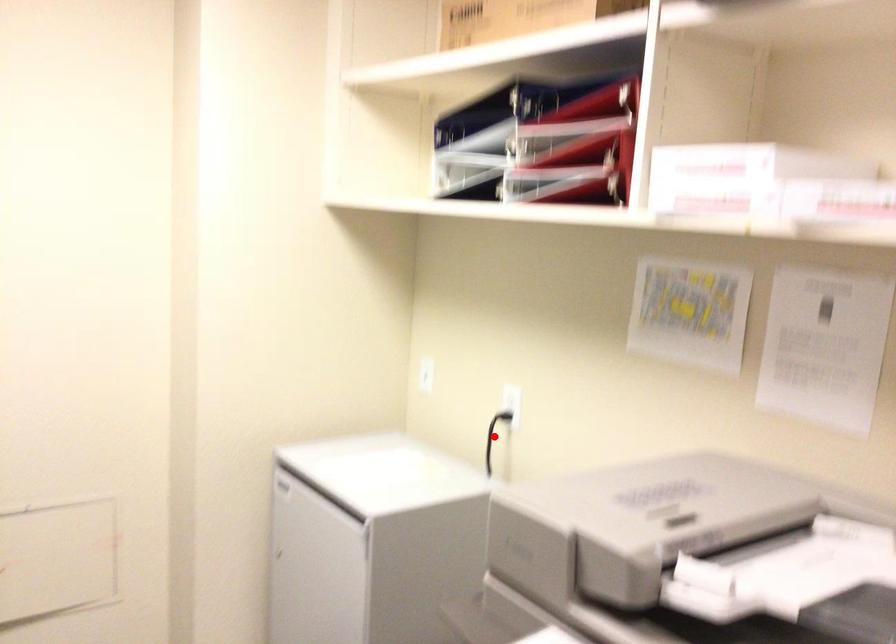
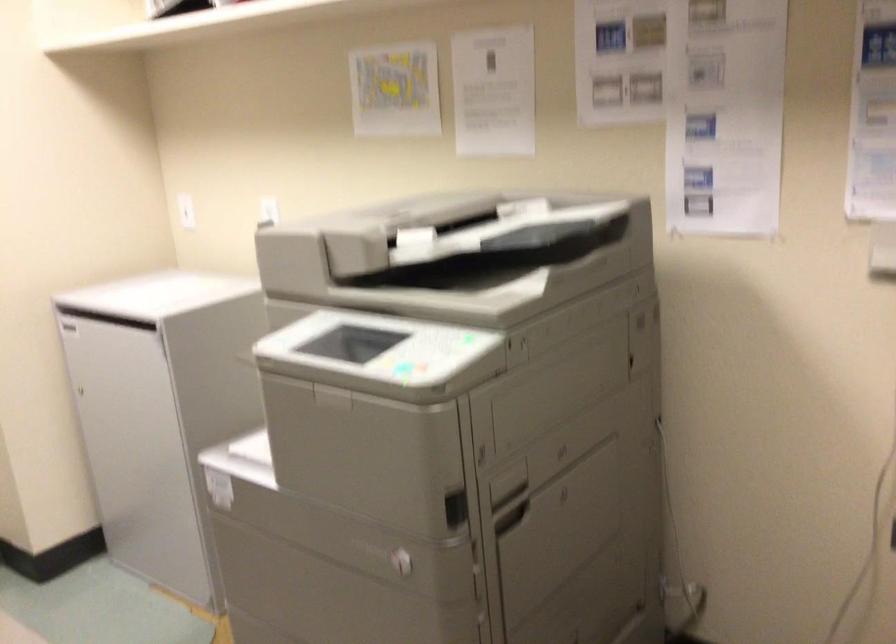
Question: I am providing you with two images of the same scene from different viewpoints. A red point is marked on the first image. Is the red point's position out of view in image 2?

Choices:
 (A) Yes
 (B) No

Answer: (A)